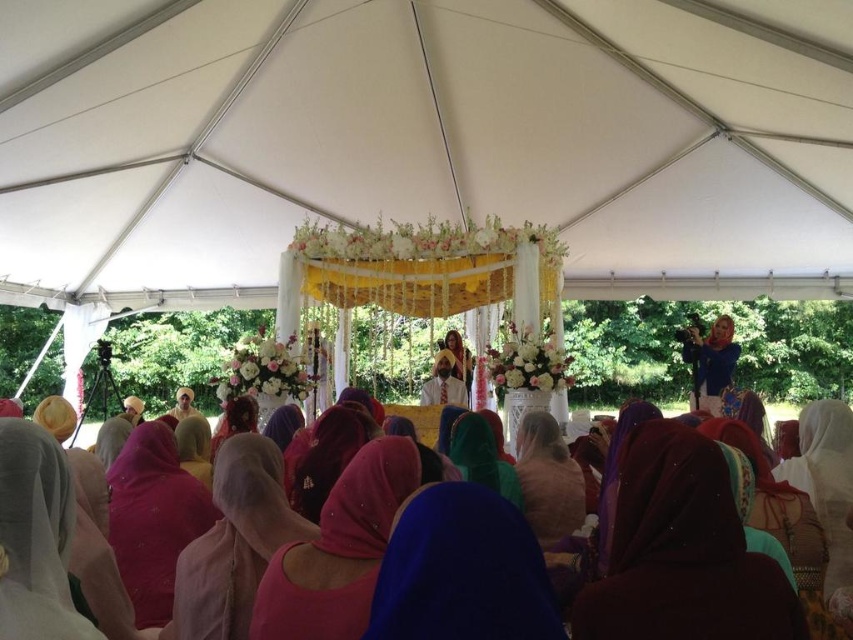
Question: Considering the relative positions of yellow fabric canopy at center and blue fabric camera at upper right in the image provided, where is yellow fabric canopy at center located with respect to blue fabric camera at upper right?

Choices:
 (A) left
 (B) right

Answer: (A)

Question: Which is farther from the yellow fabric canopy at center?

Choices:
 (A) matte pink veil at center
 (B) purple satin dupatta at center

Answer: (B)

Question: Considering the real-world distances, which object is farthest from the matte pink veil at center?

Choices:
 (A) pink satin dupatta at lower left
 (B) matte pink headscarf at lower left
 (C) pink satin dupatta at lower center
 (D) blue fabric camera at upper right

Answer: (D)

Question: Does pink satin dupatta at center have a smaller size compared to pink satin dupatta at lower center?

Choices:
 (A) no
 (B) yes

Answer: (A)

Question: Based on their relative distances, which object is nearer to the white fabric canopy at center?

Choices:
 (A) pink satin dupatta at lower center
 (B) blue fabric headscarf at center
 (C) matte pink headscarf at lower left

Answer: (A)

Question: Does pink satin dupatta at center appear over pink satin dupatta at lower left?

Choices:
 (A) no
 (B) yes

Answer: (B)